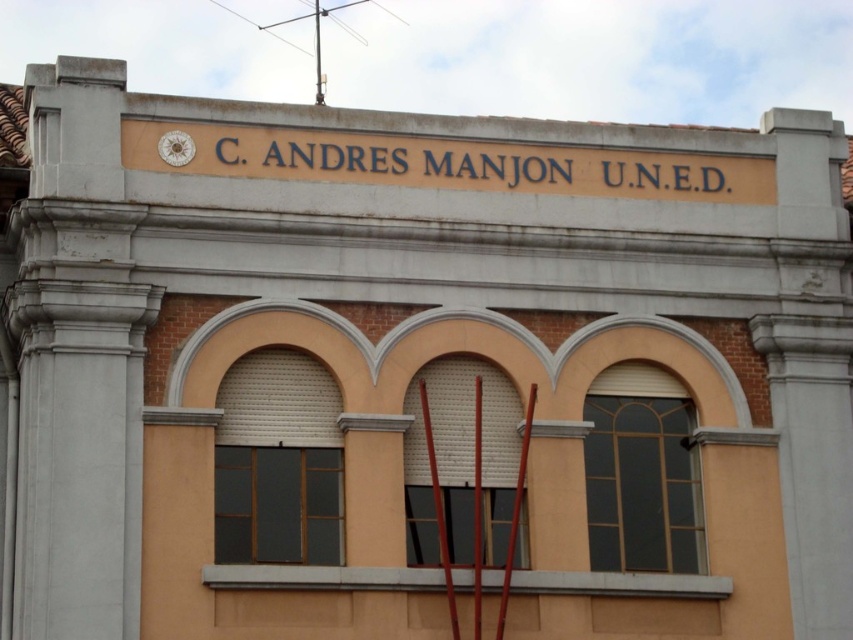
Question: Which point is farther from the camera taking this photo?

Choices:
 (A) (169, 154)
 (B) (306, 156)

Answer: (B)

Question: Is goldmaterial/texturesign at upper center smaller than gold metallic clock at upper center?

Choices:
 (A) yes
 (B) no

Answer: (B)

Question: Does goldmaterial/texturesign at upper center come in front of gold metallic clock at upper center?

Choices:
 (A) no
 (B) yes

Answer: (B)

Question: Does goldmaterial/texturesign at upper center have a larger size compared to gold metallic clock at upper center?

Choices:
 (A) yes
 (B) no

Answer: (A)

Question: Which point appears farthest from the camera in this image?

Choices:
 (A) (561, 189)
 (B) (166, 150)

Answer: (A)